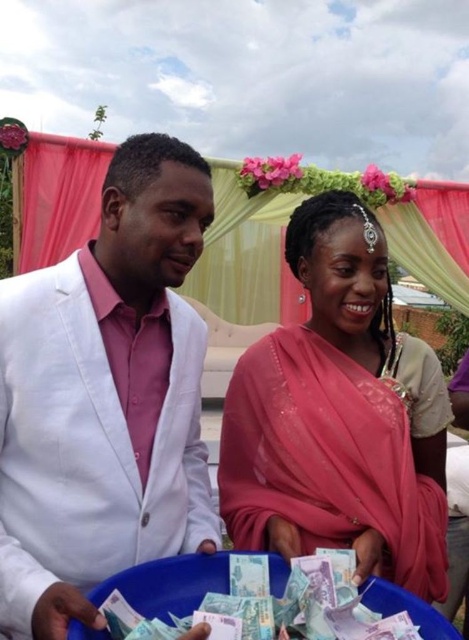
Question: Is white matte suit at left to the right of pink silk saree at center from the viewer's perspective?

Choices:
 (A) yes
 (B) no

Answer: (B)

Question: Which object is positioned farthest from the white matte suit at left?

Choices:
 (A) pink silk saree at center
 (B) light blue paper money at lower center

Answer: (B)

Question: Based on their relative distances, which object is nearer to the pink silk saree at center?

Choices:
 (A) white matte suit at left
 (B) light blue paper money at lower center

Answer: (A)

Question: Among these points, which one is nearest to the camera?

Choices:
 (A) (130, 620)
 (B) (99, 225)
 (C) (299, 218)

Answer: (A)

Question: From the image, what is the correct spatial relationship of white matte suit at left in relation to pink silk saree at center?

Choices:
 (A) left
 (B) right

Answer: (A)

Question: Can you confirm if pink silk saree at center is positioned to the right of light blue paper money at lower center?

Choices:
 (A) yes
 (B) no

Answer: (A)